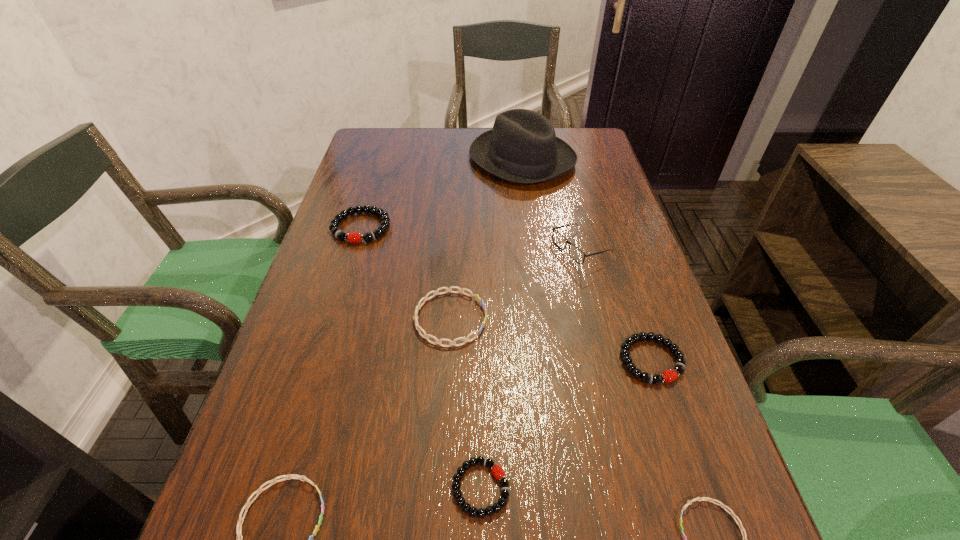
Locate an element on the screen. The width and height of the screenshot is (960, 540). object that is at the left edge is located at coordinates (353, 237).

This screenshot has height=540, width=960. I want to click on fedora that is at the right edge, so coord(522,147).

The image size is (960, 540). What are the coordinates of `spectacles at the right edge` in the screenshot? It's located at (575, 253).

This screenshot has width=960, height=540. Find the location of `bracelet present at the right edge`. bracelet present at the right edge is located at coordinates (668, 376).

I want to click on object situated at the far right corner, so click(x=522, y=147).

Where is `free space at the far edge of the desktop`? The height and width of the screenshot is (540, 960). free space at the far edge of the desktop is located at coordinates (431, 157).

Find the location of `vacant space at the left edge of the desktop`. vacant space at the left edge of the desktop is located at coordinates (342, 268).

Where is `free space at the right edge of the desktop`? This screenshot has height=540, width=960. free space at the right edge of the desktop is located at coordinates click(669, 406).

Identify the location of unoccupied position between the second smallest black bracelet and the tallest object. The image size is (960, 540). (587, 260).

Locate an element on the screen. This screenshot has width=960, height=540. blank region between the spectacles and the farthest object is located at coordinates (551, 204).